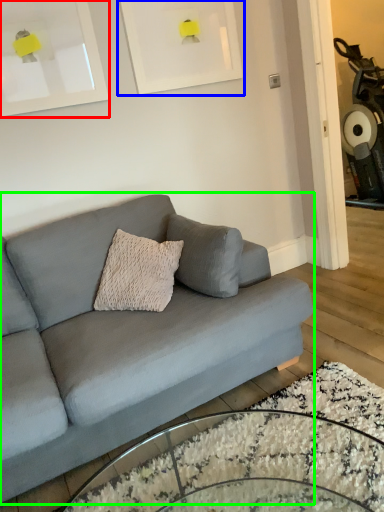
Question: Considering the real-world distances, which object is farthest from picture frame (highlighted by a red box)? picture frame (highlighted by a blue box) or studio couch (highlighted by a green box)?

Choices:
 (A) picture frame
 (B) studio couch

Answer: (B)